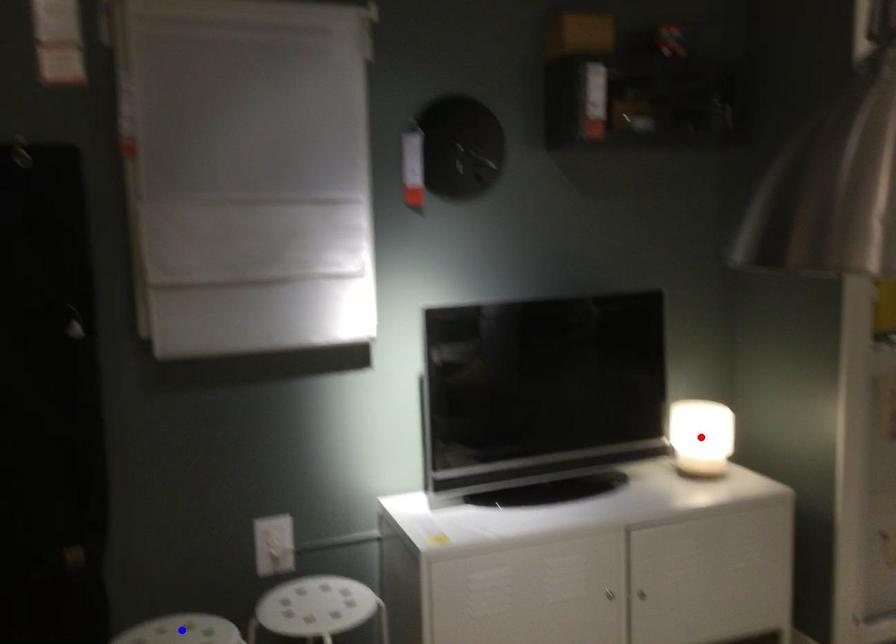
Question: Which of the two points in the image is closer to the camera?

Choices:
 (A) Blue point is closer.
 (B) Red point is closer.

Answer: (A)